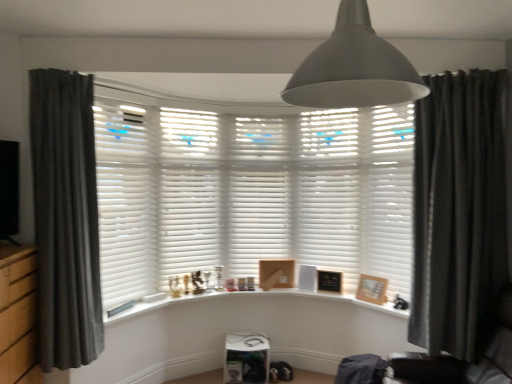
The image size is (512, 384). I want to click on free spot to the left of black matte picture frame at center, arranged as the 2th picture frame when viewed from the left, so click(316, 291).